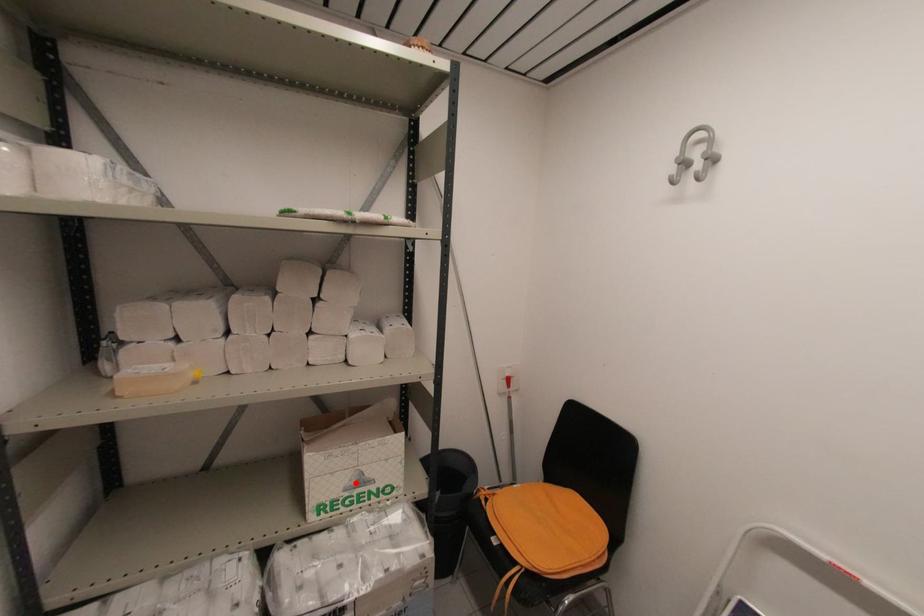
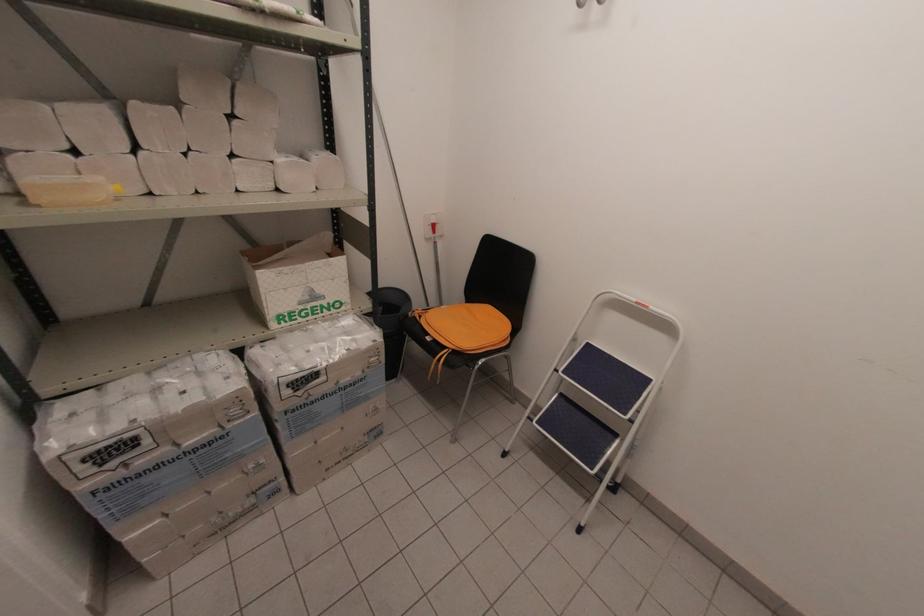
Question: I am providing you with two images of the same scene from different viewpoints. Image1 has a red point marked. In image2, the corresponding 3D location appears at what relative position? Reply with the corresponding letter.

Choices:
 (A) Closer
 (B) Farther

Answer: (A)